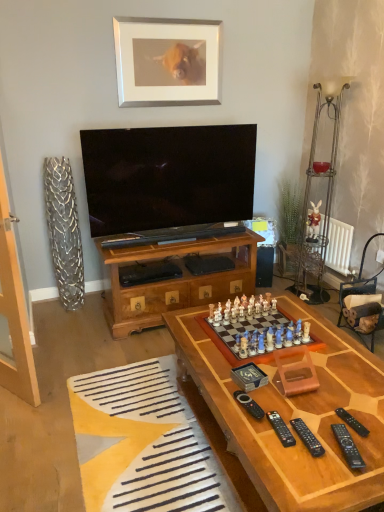
Question: Considering the relative positions of wooden chessboard at center and silver/metallic picture frame at upper center in the image provided, is wooden chessboard at center to the left of silver/metallic picture frame at upper center from the viewer's perspective?

Choices:
 (A) no
 (B) yes

Answer: (A)

Question: Is wooden chessboard at center taller than silver/metallic picture frame at upper center?

Choices:
 (A) no
 (B) yes

Answer: (A)

Question: Could you tell me if wooden chessboard at center is turned towards silver/metallic picture frame at upper center?

Choices:
 (A) yes
 (B) no

Answer: (B)

Question: Does wooden chessboard at center lie behind silver/metallic picture frame at upper center?

Choices:
 (A) yes
 (B) no

Answer: (B)

Question: From a real-world perspective, is wooden chessboard at center located higher than silver/metallic picture frame at upper center?

Choices:
 (A) yes
 (B) no

Answer: (B)

Question: Are wooden chessboard at center and silver/metallic picture frame at upper center making contact?

Choices:
 (A) yes
 (B) no

Answer: (B)

Question: Is silver/metallic picture frame at upper center inside yellow fabric rug at lower left?

Choices:
 (A) no
 (B) yes

Answer: (A)

Question: From the image's perspective, is yellow fabric rug at lower left below silver/metallic picture frame at upper center?

Choices:
 (A) no
 (B) yes

Answer: (B)

Question: Can you confirm if yellow fabric rug at lower left is positioned to the left of silver/metallic picture frame at upper center?

Choices:
 (A) no
 (B) yes

Answer: (B)

Question: Is silver/metallic picture frame at upper center at the back of yellow fabric rug at lower left?

Choices:
 (A) yes
 (B) no

Answer: (B)

Question: Is yellow fabric rug at lower left thinner than silver/metallic picture frame at upper center?

Choices:
 (A) no
 (B) yes

Answer: (A)

Question: From a real-world perspective, is yellow fabric rug at lower left physically above silver/metallic picture frame at upper center?

Choices:
 (A) yes
 (B) no

Answer: (B)

Question: Considering the relative positions of black plastic remote at lower right, which ranks as the 3th remote in right-to-left order, and yellow fabric rug at lower left in the image provided, is black plastic remote at lower right, which ranks as the 3th remote in right-to-left order, behind yellow fabric rug at lower left?

Choices:
 (A) yes
 (B) no

Answer: (B)